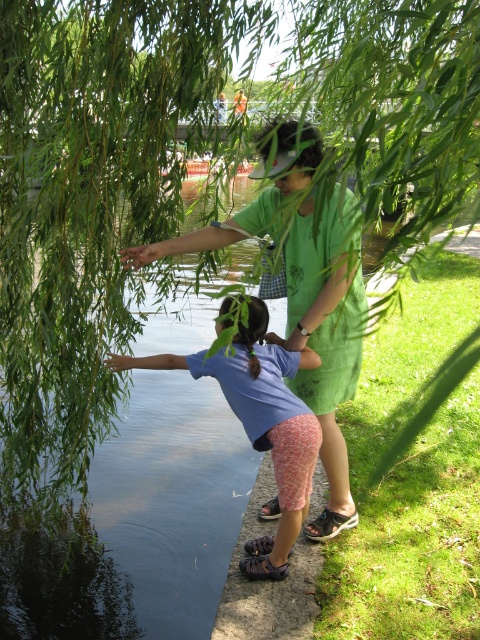
Who is higher up, green cotton shirt at center or blue cotton shirt at lower left?

green cotton shirt at center is higher up.

From the picture: Is green cotton shirt at center shorter than blue cotton shirt at lower left?

No.

What do you see at coordinates (326, 337) in the screenshot? I see `green cotton shirt at center` at bounding box center [326, 337].

This screenshot has width=480, height=640. Identify the location of green cotton shirt at center. (326, 337).